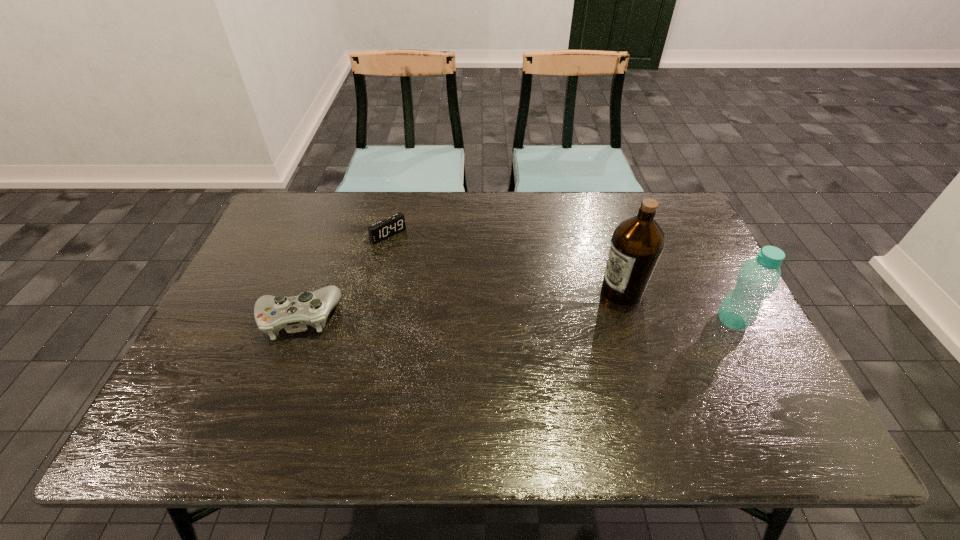
This screenshot has width=960, height=540. Identify the location of free space between the second tallest object and the farthest object. (560, 278).

You are a GUI agent. You are given a task and a screenshot of the screen. Output one action in this format:
    pyautogui.click(x=<x>, y=<y>)
    Task: Click on the free space that is in between the second object from right to left and the alarm clock
    The image size is (960, 540).
    Given the screenshot: What is the action you would take?
    pyautogui.click(x=505, y=263)

The image size is (960, 540). In order to click on free spot between the tallest object and the second object from left to right in this screenshot , I will do `click(505, 263)`.

You are a GUI agent. You are given a task and a screenshot of the screen. Output one action in this format:
    pyautogui.click(x=<x>, y=<y>)
    Task: Click on the vacant area that lies between the second object from right to left and the third tallest object
    This screenshot has width=960, height=540.
    Given the screenshot: What is the action you would take?
    pyautogui.click(x=460, y=305)

This screenshot has height=540, width=960. Identify the location of unoccupied area between the bottle and the control. (516, 319).

Identify the location of vacant space in between the second object from right to left and the shortest object. Image resolution: width=960 pixels, height=540 pixels. (505, 263).

Select which object appears as the third closest to the olive oil. Please provide its 2D coordinates. Your answer should be formatted as a tuple, i.e. [(x, y)], where the tuple contains the x and y coordinates of a point satisfying the conditions above.

[(272, 313)]

Locate an element on the screen. The height and width of the screenshot is (540, 960). object that is the third closest to the bottle is located at coordinates (272, 313).

Locate an element on the screen. The width and height of the screenshot is (960, 540). vacant region that satisfies the following two spatial constraints: 1. on the front side of the rightmost object; 2. on the left side of the shortest object is located at coordinates (368, 321).

This screenshot has width=960, height=540. I want to click on free spot that satisfies the following two spatial constraints: 1. on the front side of the second object from left to right; 2. on the right side of the second object from right to left, so click(x=375, y=291).